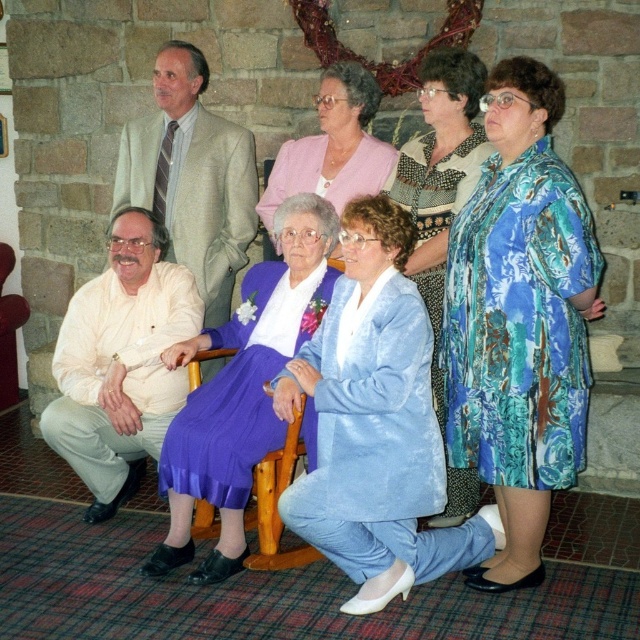
Is light blue satin suit at center thinner than purple satin skirt at center?

Incorrect, light blue satin suit at center's width is not less than purple satin skirt at center's.

Where is `light blue satin suit at center`? light blue satin suit at center is located at coordinates (374, 422).

Identify the location of light blue satin suit at center. The height and width of the screenshot is (640, 640). (374, 422).

Does pink satin dress at center have a smaller size compared to wooden chair at center?

Yes, pink satin dress at center is smaller than wooden chair at center.

Which is more to the left, pink satin dress at center or wooden chair at center?

wooden chair at center is more to the left.

The width and height of the screenshot is (640, 640). What do you see at coordinates (332, 147) in the screenshot?
I see `pink satin dress at center` at bounding box center [332, 147].

You are a GUI agent. You are given a task and a screenshot of the screen. Output one action in this format:
    pyautogui.click(x=<x>, y=<y>)
    Task: Click on the pink satin dress at center
    The image size is (640, 640).
    Given the screenshot: What is the action you would take?
    pyautogui.click(x=332, y=147)

Can you confirm if floral print dress at right is positioned to the right of light blue satin suit at center?

Yes, floral print dress at right is to the right of light blue satin suit at center.

Who is lower down, floral print dress at right or light blue satin suit at center?

light blue satin suit at center is lower down.

This screenshot has height=640, width=640. Describe the element at coordinates (518, 320) in the screenshot. I see `floral print dress at right` at that location.

Locate an element on the screen. The height and width of the screenshot is (640, 640). floral print dress at right is located at coordinates (518, 320).